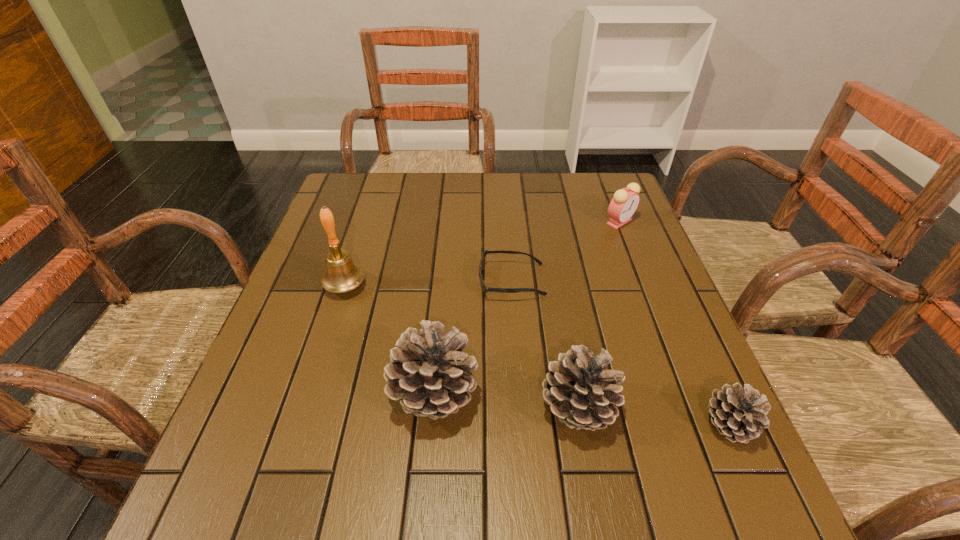
Identify the location of empty space between the second pinecone from right to left and the shortest object. Image resolution: width=960 pixels, height=540 pixels. (544, 345).

This screenshot has width=960, height=540. What are the coordinates of `free space between the shortest object and the tallest object` in the screenshot? It's located at (428, 284).

In order to click on vacant area that lies between the tallest object and the sunglasses in this screenshot , I will do `click(428, 284)`.

Identify the location of free area in between the tallest object and the rightmost pinecone. This screenshot has width=960, height=540. (537, 355).

The width and height of the screenshot is (960, 540). Find the location of `free area in between the sunglasses and the fourth shortest object`. free area in between the sunglasses and the fourth shortest object is located at coordinates (544, 345).

Identify the location of vacant area between the rightmost pinecone and the second shortest pinecone. (653, 417).

You are a GUI agent. You are given a task and a screenshot of the screen. Output one action in this format:
    pyautogui.click(x=<x>, y=<y>)
    Task: Click on the vacant space in between the second object from left to right and the sunglasses
    This screenshot has height=540, width=960.
    Given the screenshot: What is the action you would take?
    pyautogui.click(x=472, y=338)

The image size is (960, 540). Find the location of `object that is the fifth closest to the bell`. object that is the fifth closest to the bell is located at coordinates (739, 414).

Identify which object is the third nearest to the sunglasses. Please provide its 2D coordinates. Your answer should be formatted as a tuple, i.e. [(x, y)], where the tuple contains the x and y coordinates of a point satisfying the conditions above.

[(623, 205)]

Where is `pinecone that stands as the second closest to the second tallest pinecone`? pinecone that stands as the second closest to the second tallest pinecone is located at coordinates (739, 414).